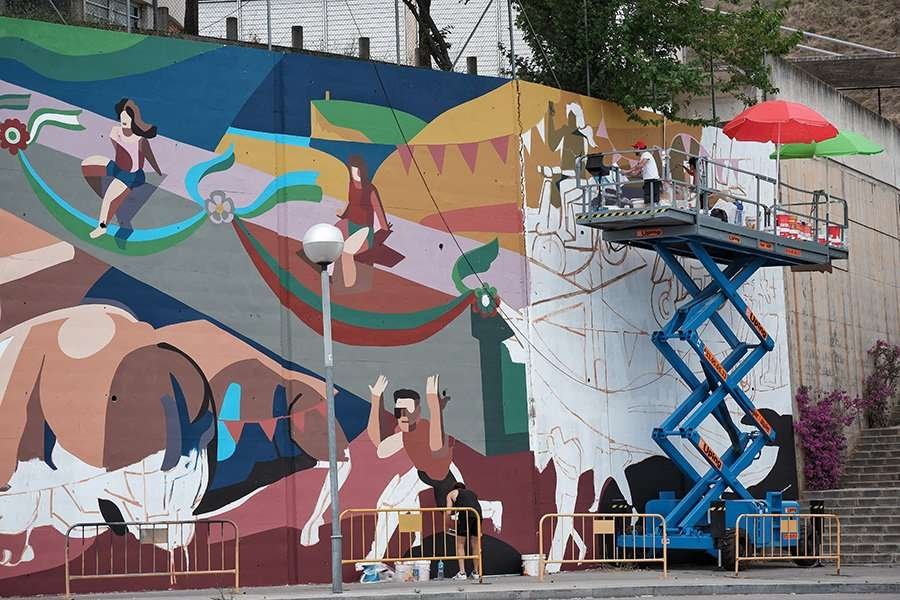
The height and width of the screenshot is (600, 900). What are the coordinates of `blue paint` in the screenshot? It's located at (144, 229).